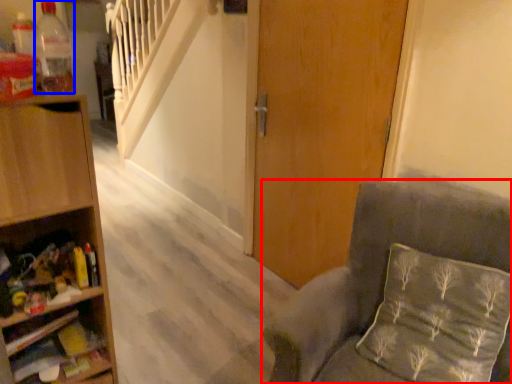
Question: Which point is further to the camera, chair (highlighted by a red box) or bottle (highlighted by a blue box)?

Choices:
 (A) chair
 (B) bottle

Answer: (B)